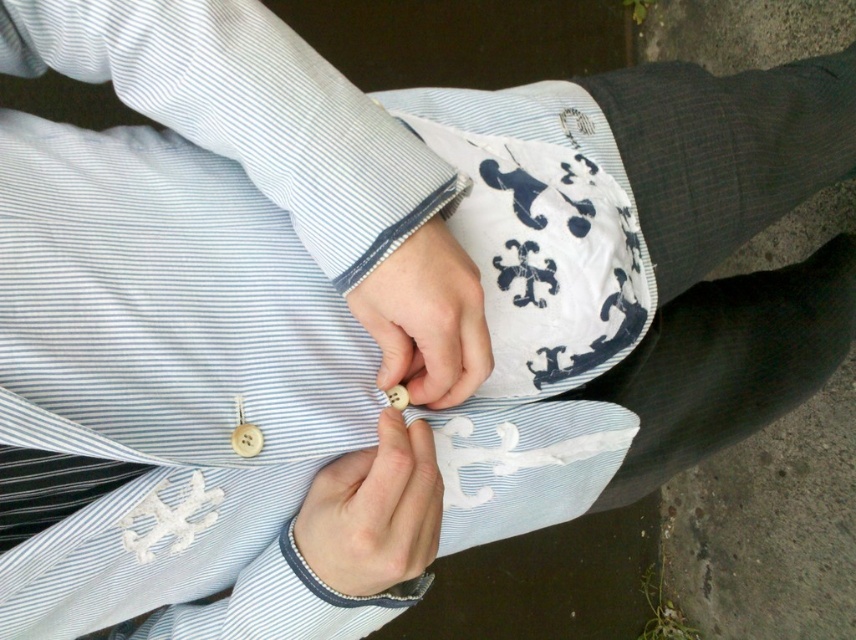
Is white matte button at center behind wooden button at center?

That is True.

Who is higher up, white matte button at center or wooden button at center?

Positioned higher is wooden button at center.

Between point (397, 576) and point (403, 248), which one is positioned in front?

Point (403, 248) is more forward.

You are a GUI agent. You are given a task and a screenshot of the screen. Output one action in this format:
    pyautogui.click(x=<x>, y=<y>)
    Task: Click on the white matte button at center
    The height and width of the screenshot is (640, 856).
    Given the screenshot: What is the action you would take?
    pyautogui.click(x=373, y=512)